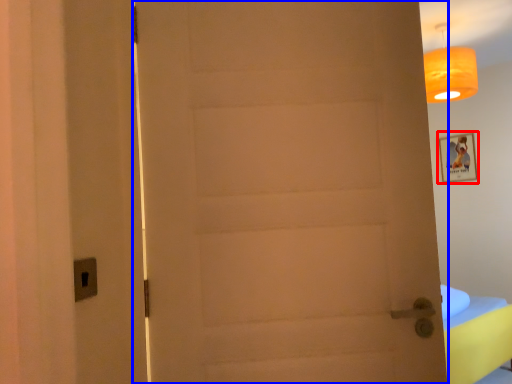
Question: Which object appears farthest to the camera in this image, picture frame (highlighted by a red box) or door (highlighted by a blue box)?

Choices:
 (A) picture frame
 (B) door

Answer: (A)